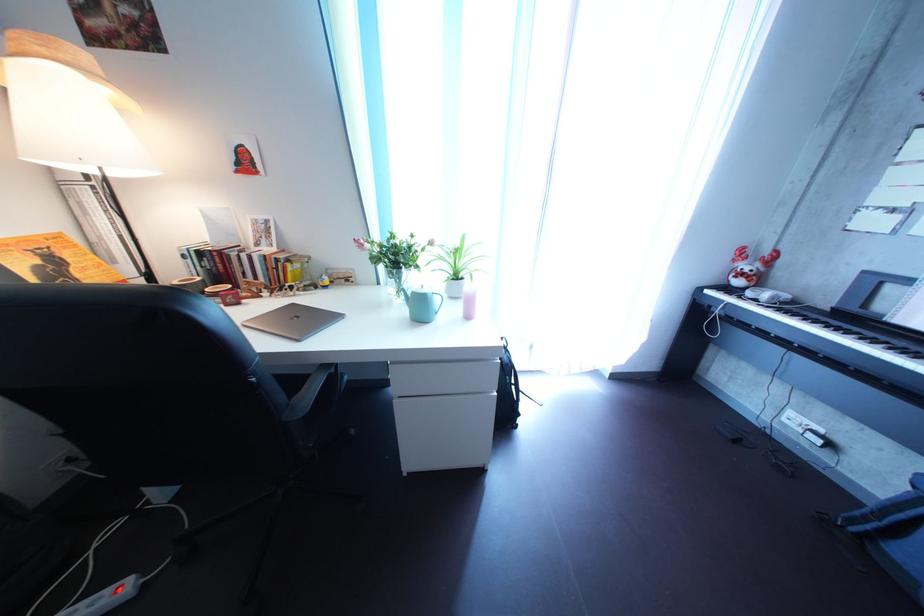
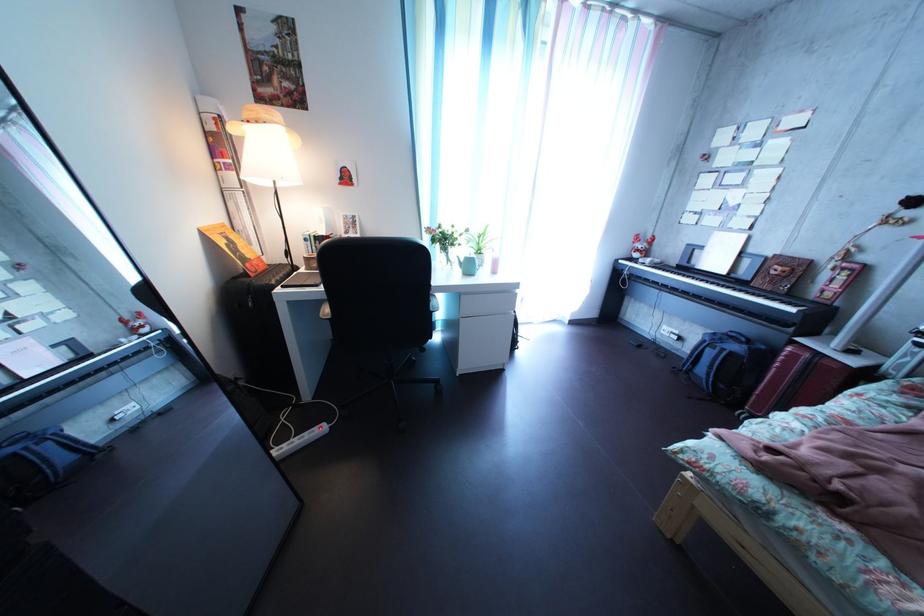
In a continuous first-person perspective shot, in which direction is the camera moving?

The cameraman moved toward left, backward.